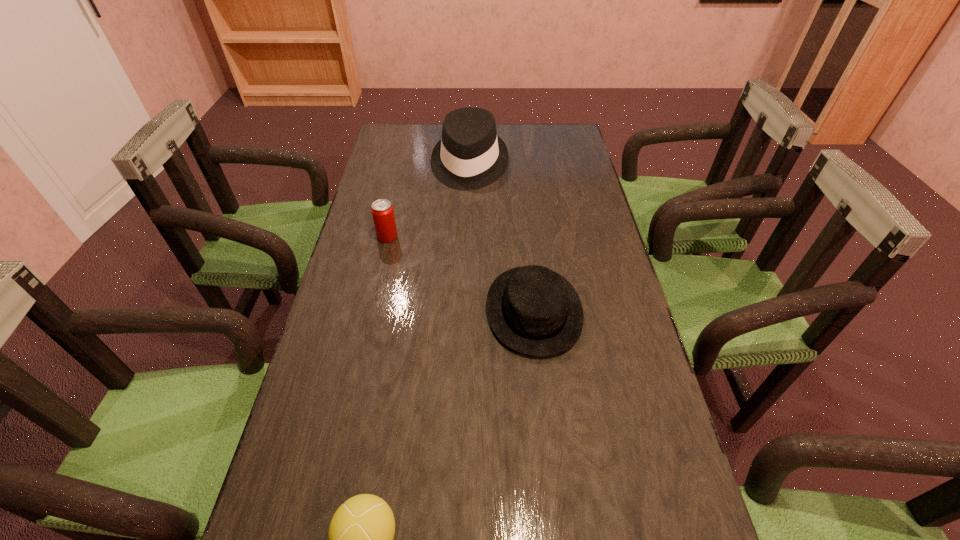
Locate an element on the screen. The height and width of the screenshot is (540, 960). the farthest object is located at coordinates (470, 155).

I want to click on the farther fedora, so click(x=470, y=155).

This screenshot has width=960, height=540. Identify the location of the second farthest object. (382, 211).

Identify the location of the nearer fedora. (535, 311).

What are the coordinates of `the shorter fedora` in the screenshot? It's located at (535, 311).

At what (x,y) coordinates should I click in order to perform the action: click on vacant space located 0.210m on the right of the farther fedora. Please return your answer as a coordinate pair (x, y). The image size is (960, 540). Looking at the image, I should click on (566, 165).

Where is `free space located on the back of the third nearest object`? The image size is (960, 540). free space located on the back of the third nearest object is located at coordinates (398, 188).

Find the location of a particular element. This screenshot has width=960, height=540. free space located on the front of the shorter fedora is located at coordinates (546, 425).

The image size is (960, 540). I want to click on object that is at the far edge, so click(x=470, y=155).

Identify the location of object situated at the left edge. This screenshot has width=960, height=540. (382, 211).